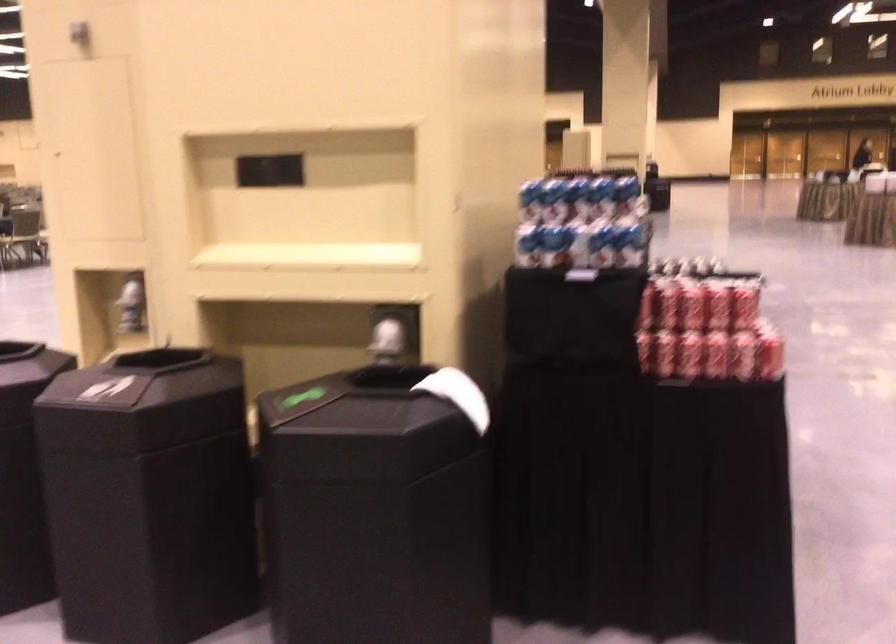
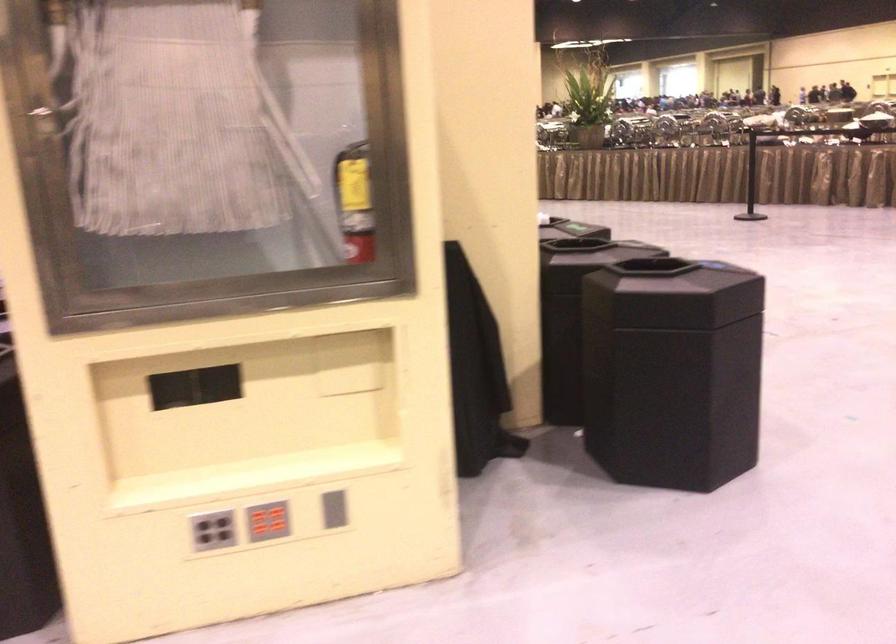
Question: I am providing you with two images of the same scene from different viewpoints. Which of the following objects are not visible in image2?

Choices:
 (A) white intercom button
 (B) black trash can lid
 (C) grey vertical slot
 (D) blue and white can

Answer: (D)